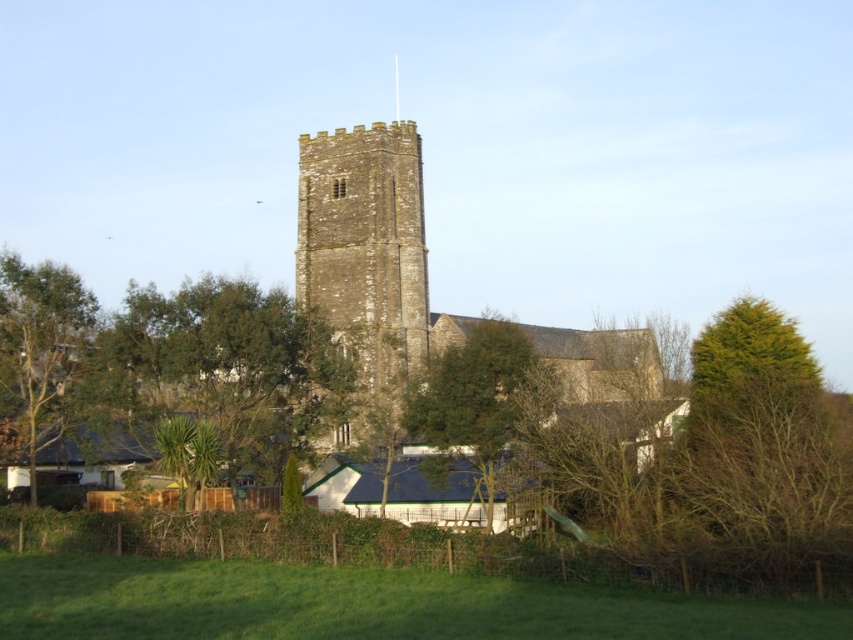
Does point (454, 326) lie in front of point (524, 349)?

No, (454, 326) is further to viewer.

Can you confirm if brown stone church at center is shorter than green leafy tree at center?

In fact, brown stone church at center may be taller than green leafy tree at center.

Is point (387, 168) positioned before point (474, 492)?

That is False.

Locate an element on the screen. brown stone church at center is located at coordinates (369, 248).

From the picture: Which of these two, brown stone tower at center or green leafy tree at center, stands taller?

brown stone tower at center

Is brown stone tower at center below green leafy tree at center?

No, brown stone tower at center is not below green leafy tree at center.

This screenshot has width=853, height=640. I want to click on brown stone tower at center, so click(x=364, y=253).

Is brown stone church at center taller than brown stone tower at center?

Yes, brown stone church at center is taller than brown stone tower at center.

The image size is (853, 640). I want to click on brown stone church at center, so click(x=369, y=248).

Is point (579, 372) farther from camera compared to point (341, 144)?

Yes, point (579, 372) is farther from viewer.

In order to click on brown stone church at center in this screenshot , I will do `click(369, 248)`.